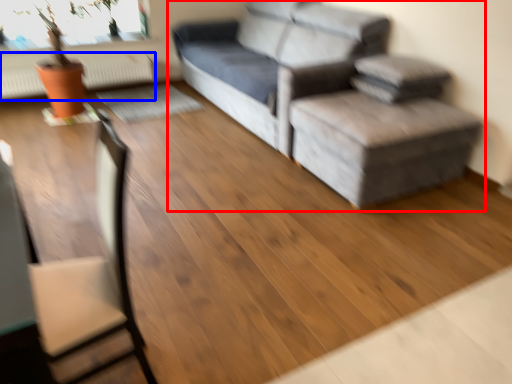
Question: Which object is further to the camera taking this photo, studio couch (highlighted by a red box) or radiator (highlighted by a blue box)?

Choices:
 (A) studio couch
 (B) radiator

Answer: (B)